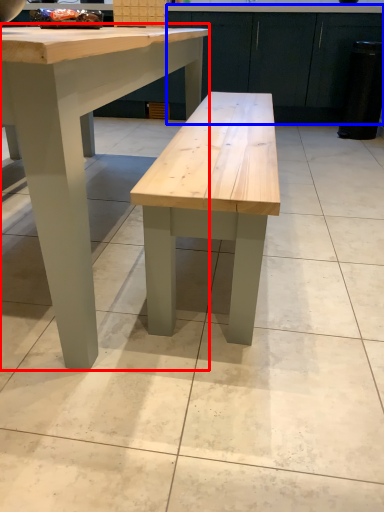
Question: Among these objects, which one is farthest to the camera, table (highlighted by a red box) or cabinetry (highlighted by a blue box)?

Choices:
 (A) table
 (B) cabinetry

Answer: (B)